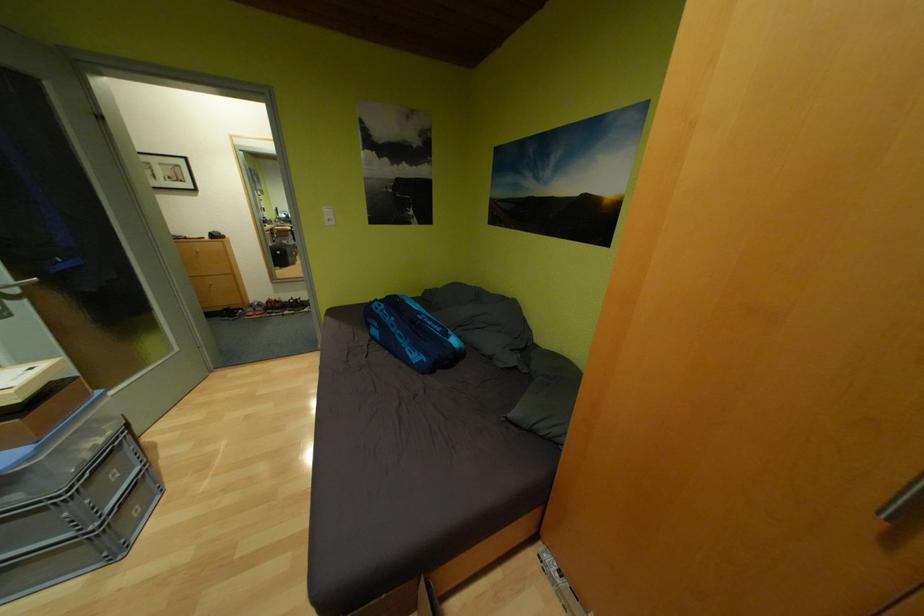
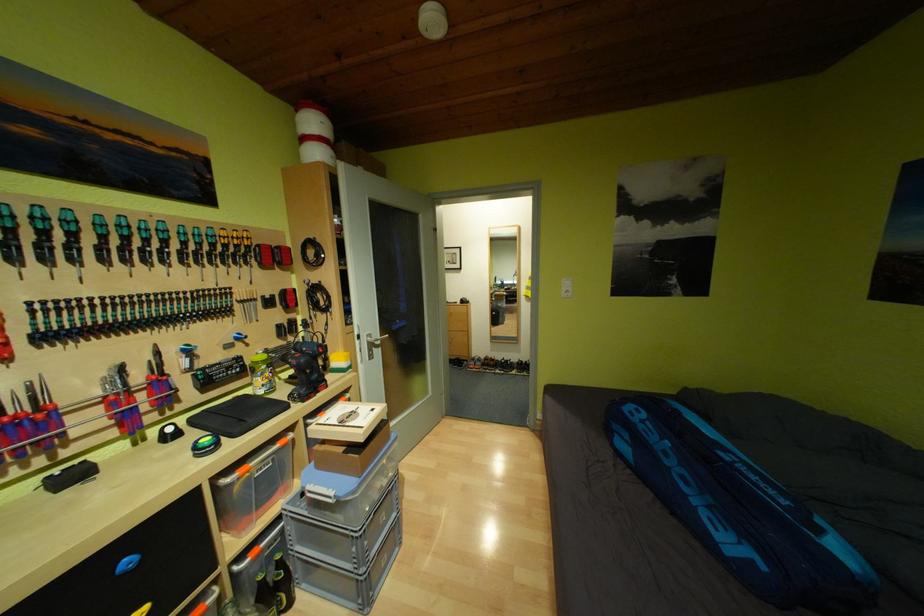
Find the pixel in the second image that matches [391,312] in the first image.

(651, 422)